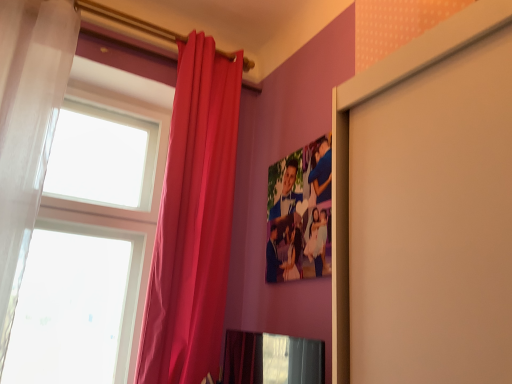
The width and height of the screenshot is (512, 384). What do you see at coordinates (28, 127) in the screenshot?
I see `sheer white curtain at left, arranged as the 2th curtain when viewed from the right` at bounding box center [28, 127].

Where is `sheer white curtain at left, which ranks as the 1th curtain in left-to-right order`? sheer white curtain at left, which ranks as the 1th curtain in left-to-right order is located at coordinates (28, 127).

How much space does matte pink curtain at upper left, which is the first curtain from right to left, occupy horizontally?

matte pink curtain at upper left, which is the first curtain from right to left, is 8.04 inches in width.

This screenshot has height=384, width=512. Describe the element at coordinates (193, 221) in the screenshot. I see `matte pink curtain at upper left, which is the first curtain from right to left` at that location.

Locate an element on the screen. matte pink curtain at upper left, which is the first curtain from right to left is located at coordinates (193, 221).

Find the location of `sheer white curtain at left, arranged as the 2th curtain when viewed from the right`. sheer white curtain at left, arranged as the 2th curtain when viewed from the right is located at coordinates (28, 127).

Which object is positioned more to the right, sheer white curtain at left, which ranks as the 1th curtain in left-to-right order, or matte pink curtain at upper left, which is the first curtain from right to left?

matte pink curtain at upper left, which is the first curtain from right to left, is more to the right.

Does sheer white curtain at left, which ranks as the 1th curtain in left-to-right order, lie in front of matte pink curtain at upper left, which ranks as the 2th curtain in left-to-right order?

That is True.

Considering the points (10, 159) and (176, 174), which point is behind, point (10, 159) or point (176, 174)?

The point (176, 174) is farther.

From the image's perspective, is sheer white curtain at left, which ranks as the 1th curtain in left-to-right order, on matte pink curtain at upper left, which is the first curtain from right to left?

Yes, from the image's perspective, sheer white curtain at left, which ranks as the 1th curtain in left-to-right order, is on top of matte pink curtain at upper left, which is the first curtain from right to left.

From a real-world perspective, which is physically above, sheer white curtain at left, arranged as the 2th curtain when viewed from the right, or matte pink curtain at upper left, which is the first curtain from right to left?

In real-world perspective, sheer white curtain at left, arranged as the 2th curtain when viewed from the right, is above.

Is sheer white curtain at left, arranged as the 2th curtain when viewed from the right, thinner than matte pink curtain at upper left, which is the first curtain from right to left?

No.

Can you confirm if sheer white curtain at left, arranged as the 2th curtain when viewed from the right, is taller than matte pink curtain at upper left, which is the first curtain from right to left?

In fact, sheer white curtain at left, arranged as the 2th curtain when viewed from the right, may be shorter than matte pink curtain at upper left, which is the first curtain from right to left.

Does sheer white curtain at left, arranged as the 2th curtain when viewed from the right, have a larger size compared to matte pink curtain at upper left, which ranks as the 2th curtain in left-to-right order?

No, sheer white curtain at left, arranged as the 2th curtain when viewed from the right, is not bigger than matte pink curtain at upper left, which ranks as the 2th curtain in left-to-right order.

Is matte pink curtain at upper left, which is the first curtain from right to left, completely or partially inside sheer white curtain at left, arranged as the 2th curtain when viewed from the right?

No, matte pink curtain at upper left, which is the first curtain from right to left, is not inside sheer white curtain at left, arranged as the 2th curtain when viewed from the right.

Is sheer white curtain at left, arranged as the 2th curtain when viewed from the right, in contact with matte pink curtain at upper left, which ranks as the 2th curtain in left-to-right order?

No.

Is sheer white curtain at left, which ranks as the 1th curtain in left-to-right order, looking in the opposite direction of matte pink curtain at upper left, which is the first curtain from right to left?

That's not correct — sheer white curtain at left, which ranks as the 1th curtain in left-to-right order, is not looking away from matte pink curtain at upper left, which is the first curtain from right to left.

What's the angular difference between sheer white curtain at left, arranged as the 2th curtain when viewed from the right, and matte pink curtain at upper left, which is the first curtain from right to left,'s facing directions?

2.3 degrees.

Could you measure the distance between sheer white curtain at left, which ranks as the 1th curtain in left-to-right order, and matte pink curtain at upper left, which is the first curtain from right to left?

A distance of 29.02 inches exists between sheer white curtain at left, which ranks as the 1th curtain in left-to-right order, and matte pink curtain at upper left, which is the first curtain from right to left.

Where is `curtain located behind the sheer white curtain at left, arranged as the 2th curtain when viewed from the right`? This screenshot has width=512, height=384. curtain located behind the sheer white curtain at left, arranged as the 2th curtain when viewed from the right is located at coordinates (193, 221).

Which object is positioned more to the left, matte pink curtain at upper left, which ranks as the 2th curtain in left-to-right order, or sheer white curtain at left, which ranks as the 1th curtain in left-to-right order?

sheer white curtain at left, which ranks as the 1th curtain in left-to-right order, is more to the left.

In the image, is matte pink curtain at upper left, which is the first curtain from right to left, positioned in front of or behind sheer white curtain at left, arranged as the 2th curtain when viewed from the right?

Clearly, matte pink curtain at upper left, which is the first curtain from right to left, is behind sheer white curtain at left, arranged as the 2th curtain when viewed from the right.

Which point is more distant from viewer, (180, 166) or (38, 120)?

The point (180, 166) is farther.

From the image's perspective, is matte pink curtain at upper left, which ranks as the 2th curtain in left-to-right order, positioned above or below sheer white curtain at left, which ranks as the 1th curtain in left-to-right order?

From the image's perspective, matte pink curtain at upper left, which ranks as the 2th curtain in left-to-right order, appears below sheer white curtain at left, which ranks as the 1th curtain in left-to-right order.

From a real-world perspective, is matte pink curtain at upper left, which is the first curtain from right to left, on top of sheer white curtain at left, which ranks as the 1th curtain in left-to-right order?

No.

Is matte pink curtain at upper left, which ranks as the 2th curtain in left-to-right order, thinner than sheer white curtain at left, which ranks as the 1th curtain in left-to-right order?

Yes, matte pink curtain at upper left, which ranks as the 2th curtain in left-to-right order, is thinner than sheer white curtain at left, which ranks as the 1th curtain in left-to-right order.

In terms of height, does matte pink curtain at upper left, which ranks as the 2th curtain in left-to-right order, look taller or shorter compared to sheer white curtain at left, arranged as the 2th curtain when viewed from the right?

In the image, matte pink curtain at upper left, which ranks as the 2th curtain in left-to-right order, appears to be taller than sheer white curtain at left, arranged as the 2th curtain when viewed from the right.

Considering the relative sizes of matte pink curtain at upper left, which is the first curtain from right to left, and sheer white curtain at left, arranged as the 2th curtain when viewed from the right, in the image provided, is matte pink curtain at upper left, which is the first curtain from right to left, smaller than sheer white curtain at left, arranged as the 2th curtain when viewed from the right,?

No.

Is sheer white curtain at left, arranged as the 2th curtain when viewed from the right, surrounded by matte pink curtain at upper left, which is the first curtain from right to left?

Actually, sheer white curtain at left, arranged as the 2th curtain when viewed from the right, is outside matte pink curtain at upper left, which is the first curtain from right to left.

Based on the photo, would you say matte pink curtain at upper left, which is the first curtain from right to left, is a long distance from sheer white curtain at left, which ranks as the 1th curtain in left-to-right order?

No, matte pink curtain at upper left, which is the first curtain from right to left, is not far away from sheer white curtain at left, which ranks as the 1th curtain in left-to-right order.

Does matte pink curtain at upper left, which is the first curtain from right to left, turn towards sheer white curtain at left, arranged as the 2th curtain when viewed from the right?

No, matte pink curtain at upper left, which is the first curtain from right to left, is not oriented towards sheer white curtain at left, arranged as the 2th curtain when viewed from the right.

How different are the orientations of matte pink curtain at upper left, which is the first curtain from right to left, and sheer white curtain at left, which ranks as the 1th curtain in left-to-right order, in degrees?

The angle between the facing direction of matte pink curtain at upper left, which is the first curtain from right to left, and the facing direction of sheer white curtain at left, which ranks as the 1th curtain in left-to-right order, is 2.3 degrees.

Where is `curtain that is in front of the matte pink curtain at upper left, which is the first curtain from right to left`? The height and width of the screenshot is (384, 512). curtain that is in front of the matte pink curtain at upper left, which is the first curtain from right to left is located at coordinates (28, 127).

Locate an element on the screen. The height and width of the screenshot is (384, 512). curtain above the matte pink curtain at upper left, which is the first curtain from right to left (from a real-world perspective) is located at coordinates click(x=28, y=127).

This screenshot has height=384, width=512. In order to click on curtain below the sheer white curtain at left, which ranks as the 1th curtain in left-to-right order (from the image's perspective) in this screenshot , I will do `click(193, 221)`.